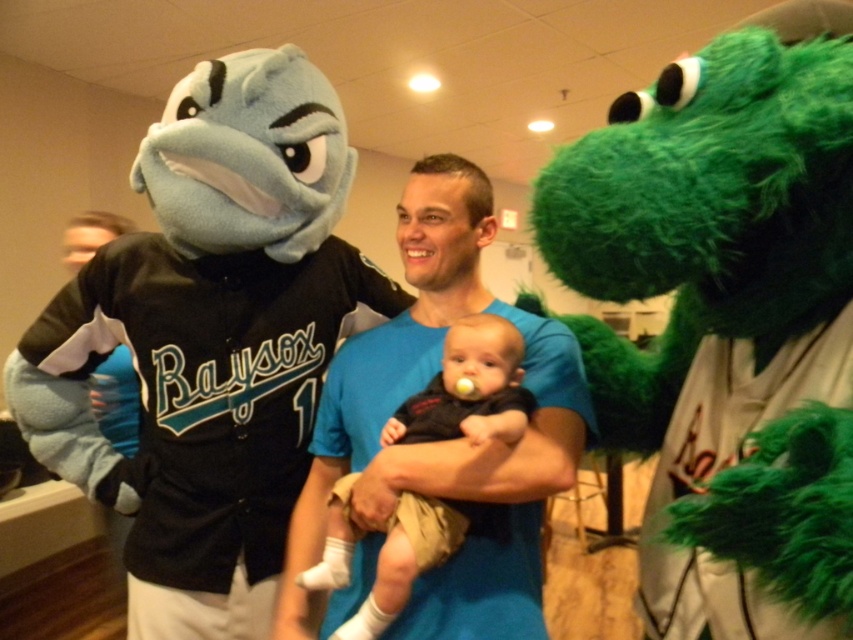
You are a photographer at this event. You need to position the green furry creature at right and the black jersey at left in a photo so that both are visible. Considering their heights, which one should be placed closer to the camera to ensure both are fully visible?

The green furry creature at right is taller than the black jersey at left, so to ensure both are fully visible in the photo, the black jersey at left should be placed closer to the camera. This way, the shorter black jersey at left won t be blocked by the taller green furry creature at right.